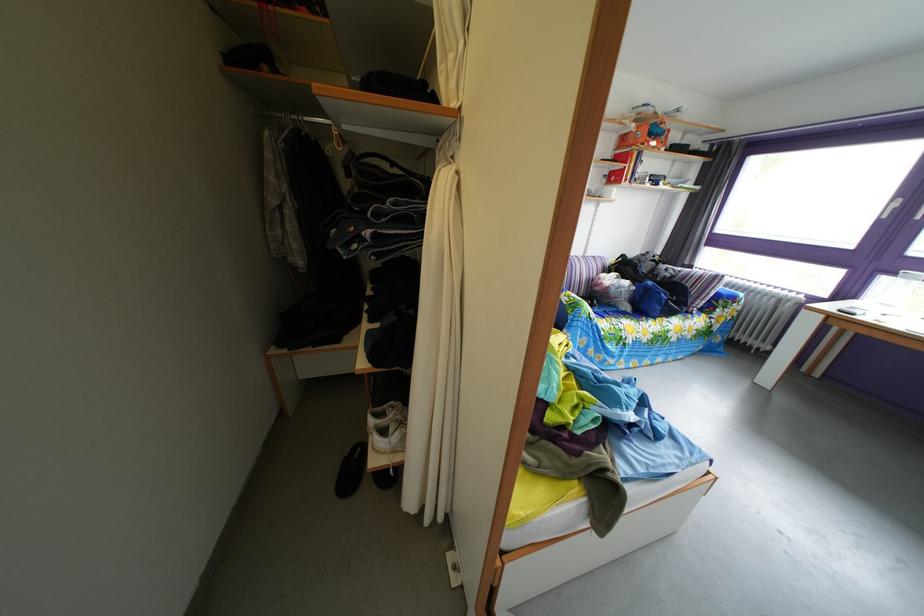
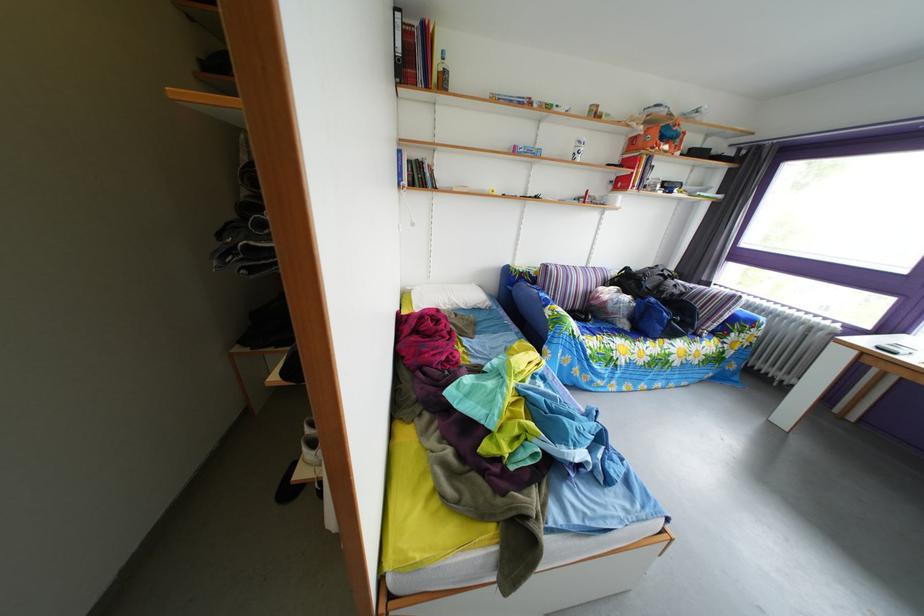
Where in the second image is the point corresponding to pixel 596 261 from the first image?

(599, 270)